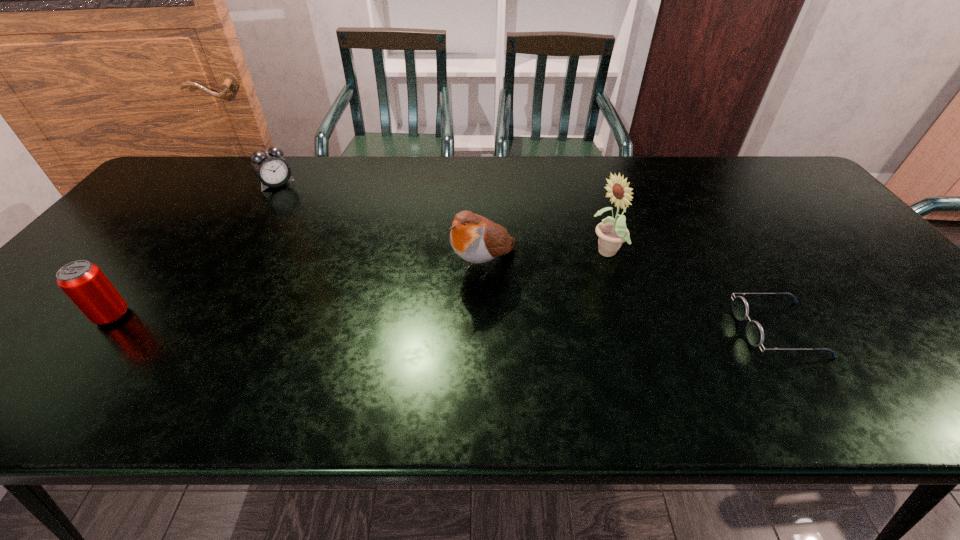
Where is `vacant space on the desktop that is between the third tallest object and the shortest object and is positioned on the front-facing side of the fourth object from left to right`? The image size is (960, 540). vacant space on the desktop that is between the third tallest object and the shortest object and is positioned on the front-facing side of the fourth object from left to right is located at coordinates (436, 322).

At what (x,y) coordinates should I click in order to perform the action: click on free spot on the desktop that is between the can and the rightmost object and is positioned on the front side of the farthest object. Please return your answer as a coordinate pair (x, y). This screenshot has width=960, height=540. Looking at the image, I should click on (408, 322).

This screenshot has height=540, width=960. Find the location of `vacant spot on the desktop that is between the can and the shortest object and is positioned at the face of the third object from right to left`. vacant spot on the desktop that is between the can and the shortest object and is positioned at the face of the third object from right to left is located at coordinates click(419, 322).